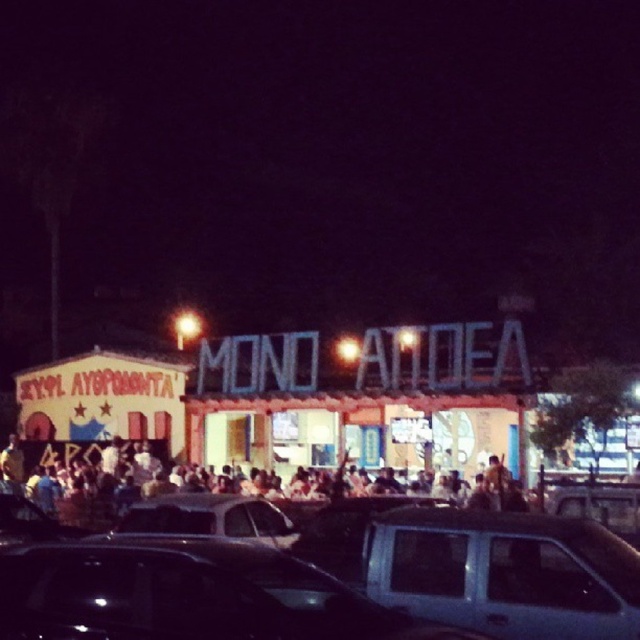
You are a pedestrian trying to cross the street in front of the building. There is a metallic silver car at center and a metallic gray sedan at lower right. Which vehicle should you avoid stepping in front of while crossing?

The metallic silver car at center is in front of the metallic gray sedan at lower right, so you should avoid stepping in front of the metallic silver car at center as it is closer to your path.

Looking at this image, you are a delivery driver who needs to park your vehicle in the parking lot near the MONO ATIDEA building. You have a metallic silver car at center and a shiny silver sedan at center. Which vehicle would require less space to park?

The metallic silver car at center occupies less space than the shiny silver sedan at center, so it would require less space to park.